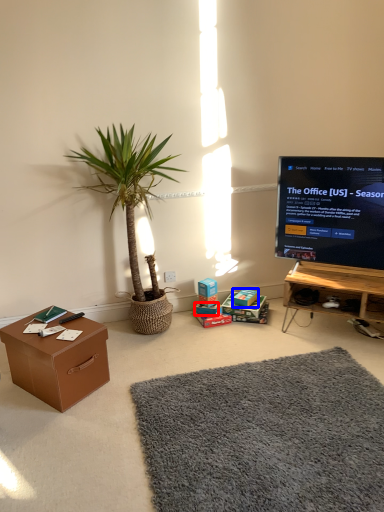
Question: Which point is closer to the camera, box (highlighted by a red box) or storage box (highlighted by a blue box)?

Choices:
 (A) box
 (B) storage box

Answer: (B)